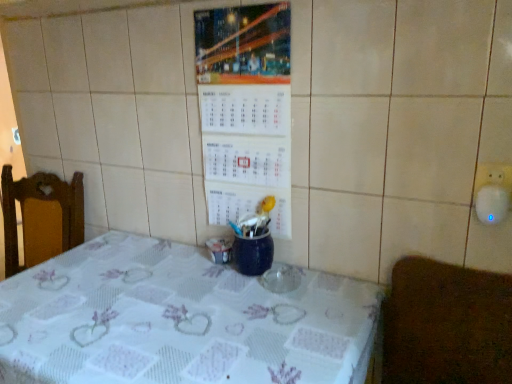
Find the location of a particular element. The width and height of the screenshot is (512, 384). white printed tablecloth at center is located at coordinates (180, 320).

What do you see at coordinates (446, 325) in the screenshot? The width and height of the screenshot is (512, 384). I see `brown textured mat at lower right` at bounding box center [446, 325].

This screenshot has height=384, width=512. What are the coordinates of `white paper calendar at center` in the screenshot? It's located at (245, 108).

What is the approximate height of white paper calendar at center?

white paper calendar at center is 26.38 inches in height.

At what (x,y) coordinates should I click in order to perform the action: click on white printed tablecloth at center. Please return your answer as a coordinate pair (x, y). Image resolution: width=512 pixels, height=384 pixels. Looking at the image, I should click on (180, 320).

Which of these two, white paper calendar at center or white printed tablecloth at center, is wider?

With larger width is white printed tablecloth at center.

Is white printed tablecloth at center inside white paper calendar at center?

No, white printed tablecloth at center is not a part of white paper calendar at center.

Where is `bulletin board above the white printed tablecloth at center (from a real-world perspective)`? The width and height of the screenshot is (512, 384). bulletin board above the white printed tablecloth at center (from a real-world perspective) is located at coordinates (245, 108).

From the image's perspective, is white paper calendar at center on white printed tablecloth at center?

A: Correct, white paper calendar at center appears higher than white printed tablecloth at center in the image.

At what (x,y) coordinates should I click in order to perform the action: click on furniture lying on the right of white paper calendar at center. Please return your answer as a coordinate pair (x, y). The image size is (512, 384). Looking at the image, I should click on (446, 325).

Does brown textured mat at lower right have a greater height compared to white paper calendar at center?

Incorrect, the height of brown textured mat at lower right is not larger of that of white paper calendar at center.

Considering the positions of objects brown textured mat at lower right and white paper calendar at center in the image provided, who is more to the left, brown textured mat at lower right or white paper calendar at center?

From the viewer's perspective, white paper calendar at center appears more on the left side.

Is white paper calendar at center at the back of brown textured mat at lower right?

No.

Find the location of a particular element. bulletin board above the white printed tablecloth at center (from a real-world perspective) is located at coordinates (245, 108).

Which of these two, white printed tablecloth at center or white paper calendar at center, is wider?

With larger width is white printed tablecloth at center.

From the image's perspective, which one is positioned lower, white printed tablecloth at center or white paper calendar at center?

From the image's view, white printed tablecloth at center is below.

Considering the sizes of objects white printed tablecloth at center and white paper calendar at center in the image provided, who is shorter, white printed tablecloth at center or white paper calendar at center?

white paper calendar at center is shorter.

Is brown textured mat at lower right positioned far away from white printed tablecloth at center?

They are positioned close to each other.

Can you confirm if brown textured mat at lower right is bigger than white printed tablecloth at center?

Actually, brown textured mat at lower right might be smaller than white printed tablecloth at center.

Is brown textured mat at lower right taller than white printed tablecloth at center?

Incorrect, the height of brown textured mat at lower right is not larger of that of white printed tablecloth at center.

Is point (385, 331) closer to camera compared to point (7, 294)?

Yes.

Is white printed tablecloth at center situated inside brown textured mat at lower right or outside?

white printed tablecloth at center is spatially situated outside brown textured mat at lower right.

Which is closer, [183,332] or [441,320]?

Point [183,332] appears to be closer to the viewer than point [441,320].

Where is `table that is below the brown textured mat at lower right (from the image's perspective)`? table that is below the brown textured mat at lower right (from the image's perspective) is located at coordinates (180, 320).

Is white printed tablecloth at center turned away from brown textured mat at lower right?

No, white printed tablecloth at center is not facing the opposite direction of brown textured mat at lower right.

From a real-world perspective, is white paper calendar at center physically located above or below brown textured mat at lower right?

white paper calendar at center is above brown textured mat at lower right.

You are a GUI agent. You are given a task and a screenshot of the screen. Output one action in this format:
    pyautogui.click(x=<x>, y=<y>)
    Task: Click on the furniture in front of the white paper calendar at center
    The width and height of the screenshot is (512, 384).
    Given the screenshot: What is the action you would take?
    pyautogui.click(x=446, y=325)

Does white paper calendar at center contain brown textured mat at lower right?

No.

What's the angular difference between white paper calendar at center and brown textured mat at lower right's facing directions?

The angle between the facing direction of white paper calendar at center and the facing direction of brown textured mat at lower right is 1.41 degrees.

The width and height of the screenshot is (512, 384). Identify the location of bulletin board lying on the right of white printed tablecloth at center. pos(245,108).

Identify the location of furniture in front of the white paper calendar at center. (446, 325).

Based on their spatial positions, is white printed tablecloth at center or brown textured mat at lower right closer to white paper calendar at center?

white printed tablecloth at center.

Looking at the image, which one is located closer to brown textured mat at lower right, white printed tablecloth at center or white paper calendar at center?

white printed tablecloth at center is positioned closer to the anchor brown textured mat at lower right.

Based on their spatial positions, is brown textured mat at lower right or white printed tablecloth at center closer to white paper calendar at center?

Among the two, white printed tablecloth at center is located nearer to white paper calendar at center.

Based on their spatial positions, is brown textured mat at lower right or white paper calendar at center further from white printed tablecloth at center?

white paper calendar at center is positioned further to the anchor white printed tablecloth at center.

Estimate the real-world distances between objects in this image. Which object is closer to brown textured mat at lower right, white paper calendar at center or white printed tablecloth at center?

white printed tablecloth at center.

When comparing their distances from white printed tablecloth at center, does white paper calendar at center or brown textured mat at lower right seem further?

white paper calendar at center is positioned further to the anchor white printed tablecloth at center.

The height and width of the screenshot is (384, 512). In order to click on furniture that lies between white paper calendar at center and white printed tablecloth at center from top to bottom in this screenshot , I will do `click(446, 325)`.